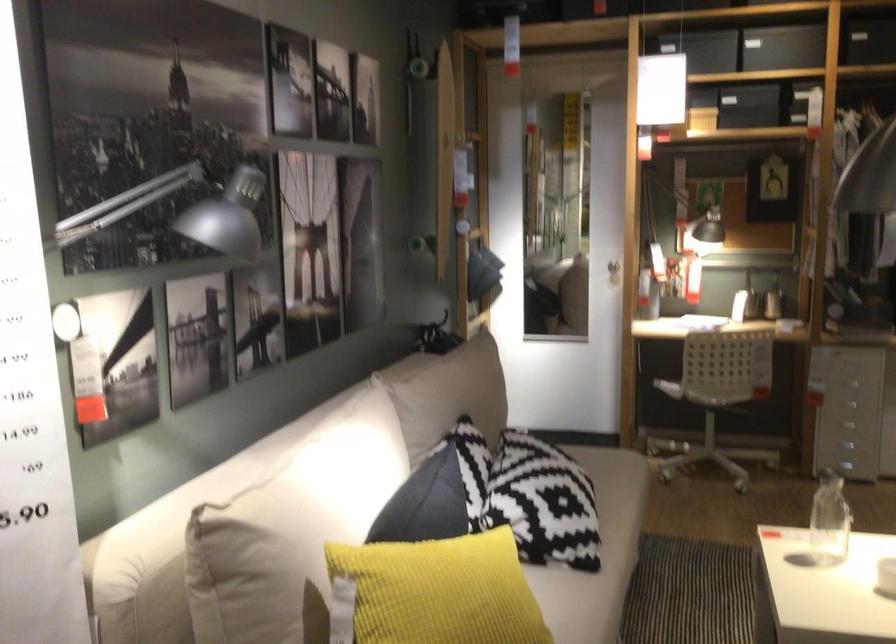
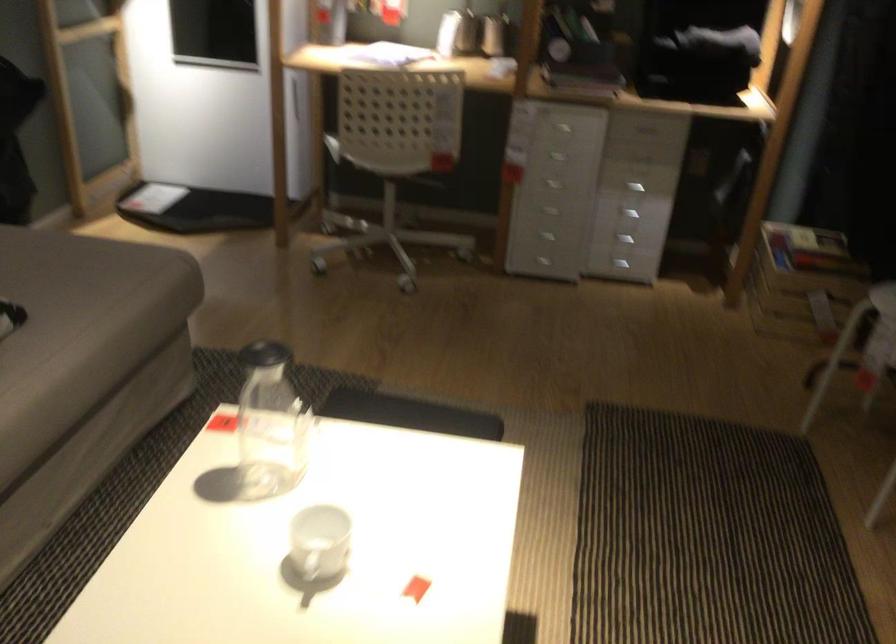
Locate, in the second image, the point that corresponds to the point at 624,495 in the first image.

(82, 324)